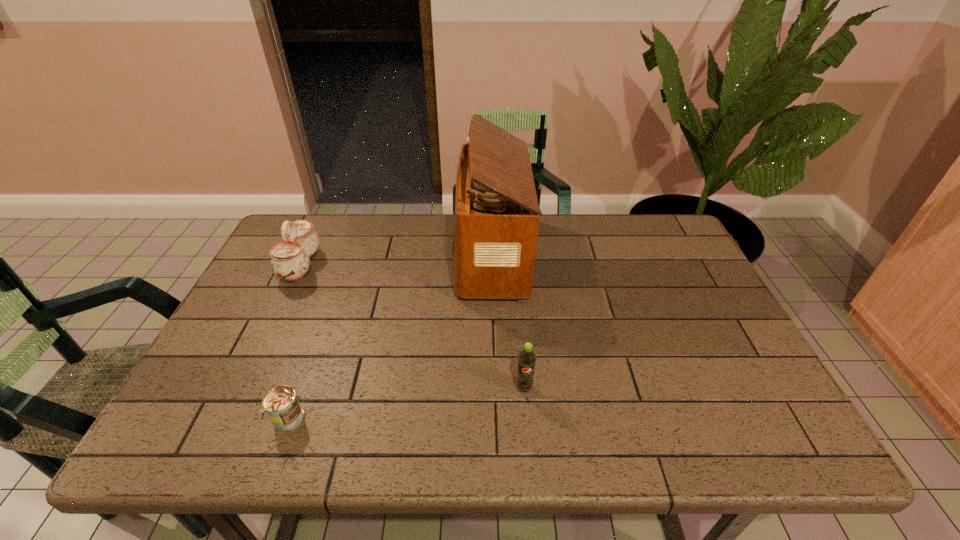
Find the location of a particular element. The image size is (960, 540). vacant space that is in between the can and the leftmost object is located at coordinates (295, 342).

Identify the location of empty location between the leftmost object and the can. This screenshot has width=960, height=540. (295, 342).

The image size is (960, 540). I want to click on free space that is in between the second nearest object and the radio receiver, so click(507, 321).

Find the location of a particular element. Image resolution: width=960 pixels, height=540 pixels. vacant area that lies between the leftmost object and the shortest object is located at coordinates (295, 342).

Where is `vacant area between the nearest object and the radio receiver`? vacant area between the nearest object and the radio receiver is located at coordinates (389, 338).

Find the location of a particular element. This screenshot has height=540, width=960. free space between the leftmost object and the nearest object is located at coordinates pos(295,342).

Image resolution: width=960 pixels, height=540 pixels. In order to click on vacant area between the second nearest object and the nearest object in this screenshot , I will do `click(406, 403)`.

Identify the location of vacant region between the chinaware and the third farthest object. (412, 327).

Find the location of a particular element. The image size is (960, 540). empty space that is in between the tallest object and the third farthest object is located at coordinates (507, 321).

Identify the location of object that ranks as the closest to the tallest object. Image resolution: width=960 pixels, height=540 pixels. (527, 358).